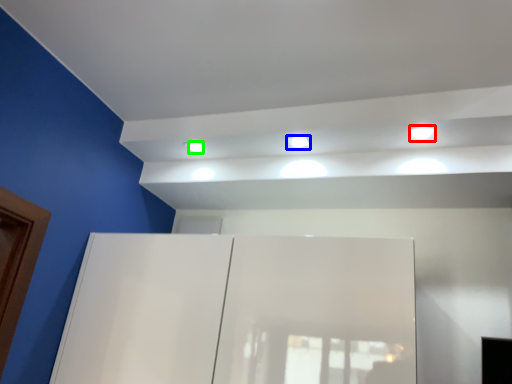
Question: Which is nearer to the light (highlighted by a red box)? light (highlighted by a blue box) or dot (highlighted by a green box).

Choices:
 (A) light
 (B) dot

Answer: (A)